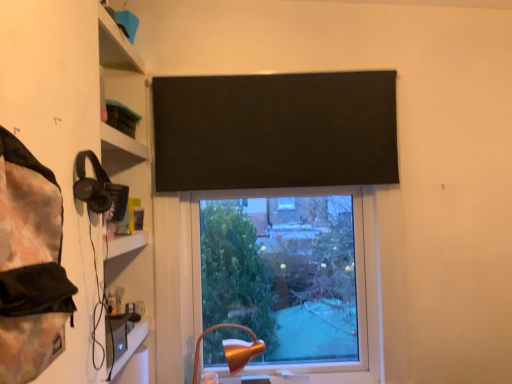
Question: Should I look upward or downward to see black matte curtain at upper center?

Choices:
 (A) up
 (B) down

Answer: (A)